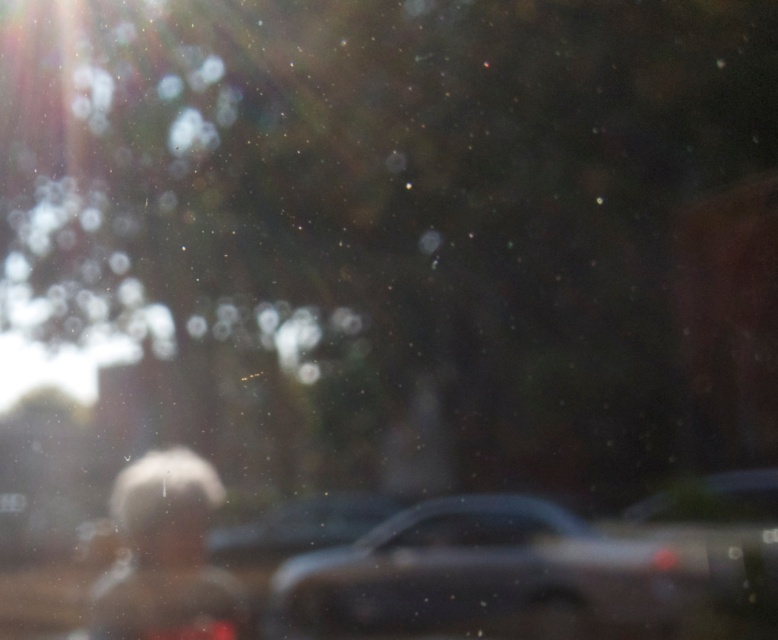
Question: Can you confirm if metallic gray car at center is bigger than transparent glass car window at center?

Choices:
 (A) yes
 (B) no

Answer: (A)

Question: Which of the following is the farthest from the observer?

Choices:
 (A) transparent glass car window at center
 (B) metallic gray car at center
 (C) white matte hair at center

Answer: (A)

Question: Based on their relative distances, which object is nearer to the metallic gray car at center?

Choices:
 (A) transparent glass car window at center
 (B) white matte hair at center

Answer: (A)

Question: Which of these objects is positioned farthest from the transparent glass car window at center?

Choices:
 (A) metallic gray car at center
 (B) white matte hair at center

Answer: (B)

Question: Observing the image, what is the correct spatial positioning of metallic gray car at center in reference to white matte hair at center?

Choices:
 (A) right
 (B) left

Answer: (A)

Question: Does white matte hair at center lie behind transparent glass car window at center?

Choices:
 (A) yes
 (B) no

Answer: (B)